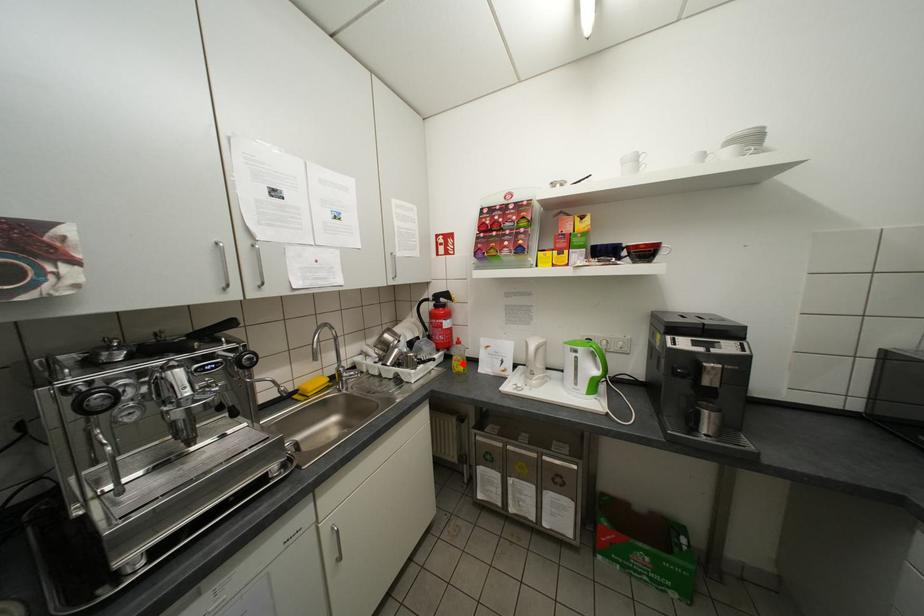
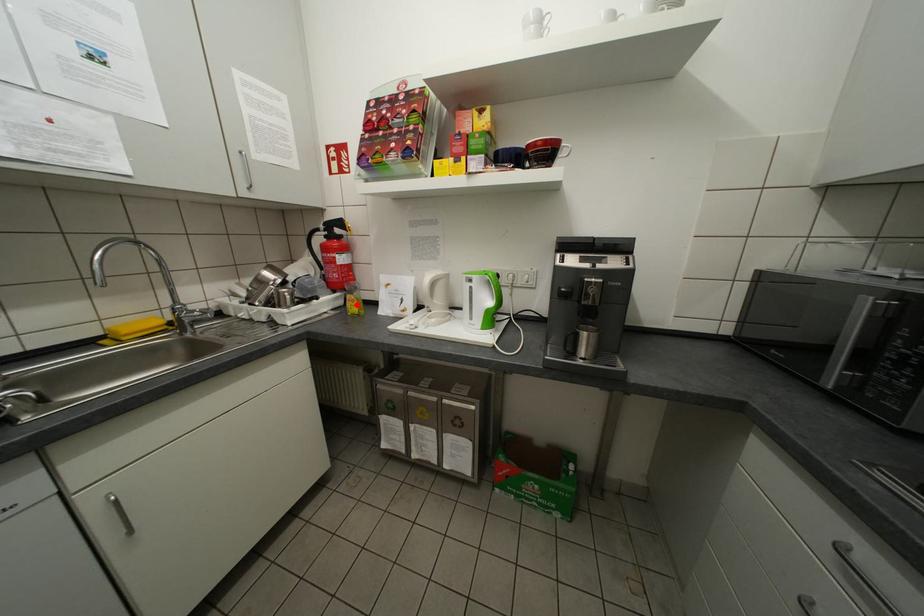
I am providing you with two images of the same scene from different viewpoints. A red point is marked on the first image and another point is marked on the second image. Do the highlighted points in image1 and image2 indicate the same real-world spot?

Yes